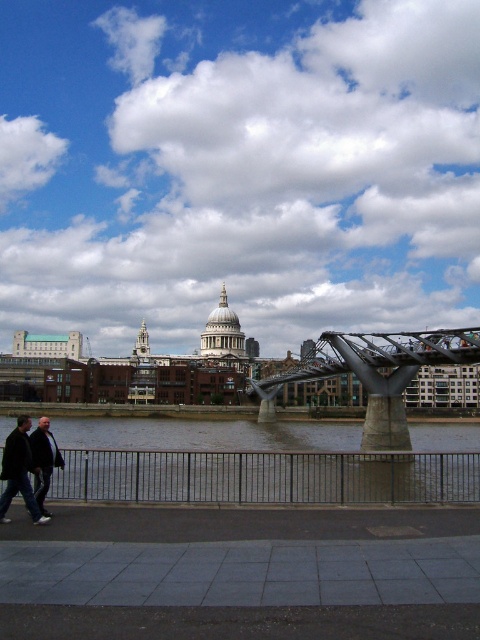
Between dark gray concrete river at lower center and metallic gray bridge at center, which one is positioned higher?

Positioned higher is metallic gray bridge at center.

Between point (331, 481) and point (421, 339), which one is positioned in front?

Point (331, 481) is more forward.

Where is `dark gray concrete river at lower center`? dark gray concrete river at lower center is located at coordinates (260, 461).

Is point (143, 42) positioned after point (36, 518)?

Yes, it is behind point (36, 518).

Can you confirm if white fluffy clouds at upper center is taller than dark gray coat at lower left?

Correct, white fluffy clouds at upper center is much taller as dark gray coat at lower left.

Does point (96, 336) lie in front of point (26, 484)?

No, (96, 336) is further to viewer.

You are a GUI agent. You are given a task and a screenshot of the screen. Output one action in this format:
    pyautogui.click(x=<x>, y=<y>)
    Task: Click on the white fluffy clouds at upper center
    The width and height of the screenshot is (480, 640).
    Given the screenshot: What is the action you would take?
    pyautogui.click(x=238, y=166)

Which is below, dark gray concrete river at lower center or dark gray coat at lower left?

dark gray concrete river at lower center is below.

Is dark gray concrete river at lower center below dark gray coat at lower left?

Yes, dark gray concrete river at lower center is below dark gray coat at lower left.

Is point (173, 492) farther from viewer compared to point (12, 460)?

That is True.

Find the location of a particular element. dark gray concrete river at lower center is located at coordinates click(260, 461).